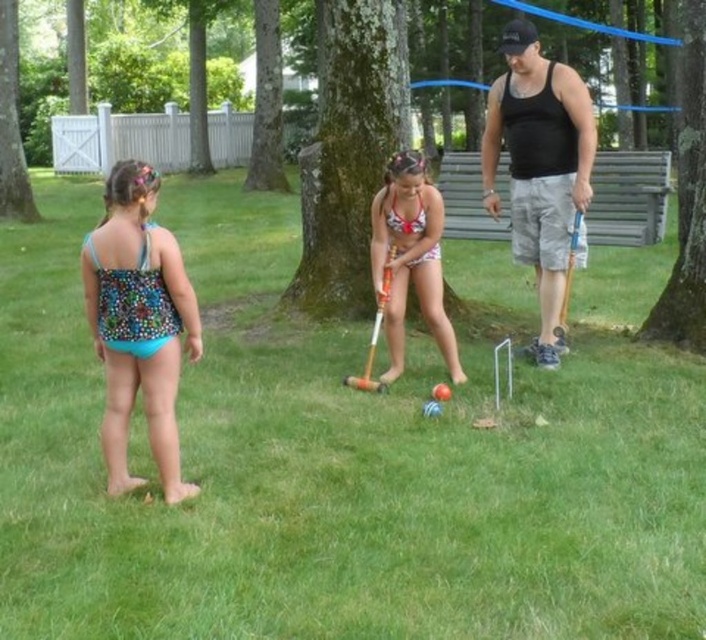
Is the position of printed fabric swimsuit at left less distant than that of white polka dot swimsuit at center?

Yes, printed fabric swimsuit at left is in front of white polka dot swimsuit at center.

Is printed fabric swimsuit at left above white polka dot swimsuit at center?

No, printed fabric swimsuit at left is not above white polka dot swimsuit at center.

The height and width of the screenshot is (640, 706). Identify the location of printed fabric swimsuit at left. (138, 323).

Does green grass at center have a larger size compared to white polka dot swimsuit at center?

Indeed, green grass at center has a larger size compared to white polka dot swimsuit at center.

Which of these two, green grass at center or white polka dot swimsuit at center, stands shorter?

With less height is white polka dot swimsuit at center.

Is point (227, 440) in front of point (450, 358)?

That is True.

What are the coordinates of `green grass at center` in the screenshot? It's located at (342, 460).

Between point (585, 90) and point (455, 340), which one is positioned in front?

Positioned in front is point (585, 90).

Between black tank top at right and white polka dot swimsuit at center, which one appears on the left side from the viewer's perspective?

From the viewer's perspective, white polka dot swimsuit at center appears more on the left side.

You are a GUI agent. You are given a task and a screenshot of the screen. Output one action in this format:
    pyautogui.click(x=<x>, y=<y>)
    Task: Click on the black tank top at right
    The image size is (706, 640).
    Given the screenshot: What is the action you would take?
    pyautogui.click(x=539, y=166)

The width and height of the screenshot is (706, 640). In order to click on black tank top at right in this screenshot , I will do `click(539, 166)`.